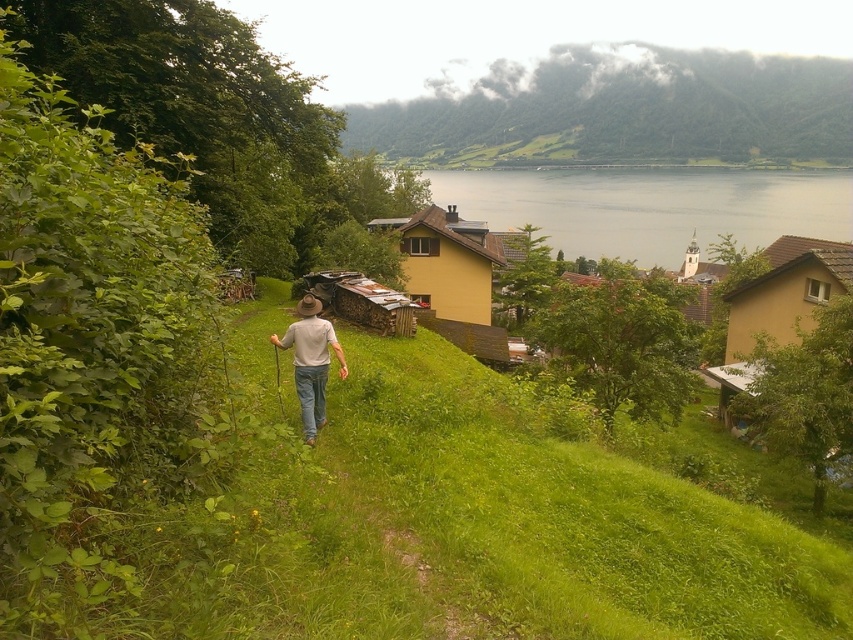
You are a hiker trying to reach the yellow matte house at center from the green grassy hillside at upper center. Based on the scene, which direction should you head towards?

The green grassy hillside at upper center is much taller than the yellow matte house at center, so you should head downhill towards the yellow matte house at center.

You are a traveler on the path and want to reach the yellow matte house at right before the light brown leather hat at center. Which one is closer to you?

The yellow matte house at right is larger in size than the light brown leather hat at center, but size does not indicate distance. To determine which is closer, you would need to consider their positions along your path. Since both are on the path, the one ahead would be closer. However, based on the given information, the description only states size, not distance. Therefore, I cannot accurately determine which is closer based on the provided details.